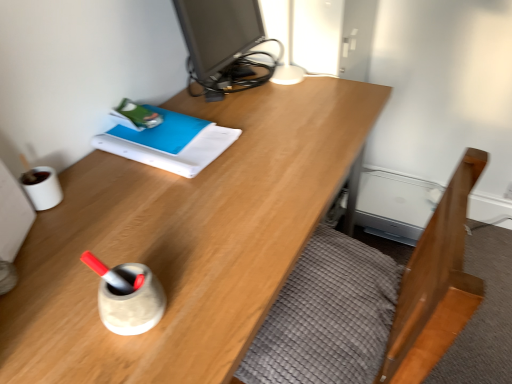
At what (x,y) coordinates should I click in order to perform the action: click on empty space that is ontop of wooden desk at center (from a real-world perspective). Please return your answer as a coordinate pair (x, y). This screenshot has width=512, height=384. Looking at the image, I should click on (205, 178).